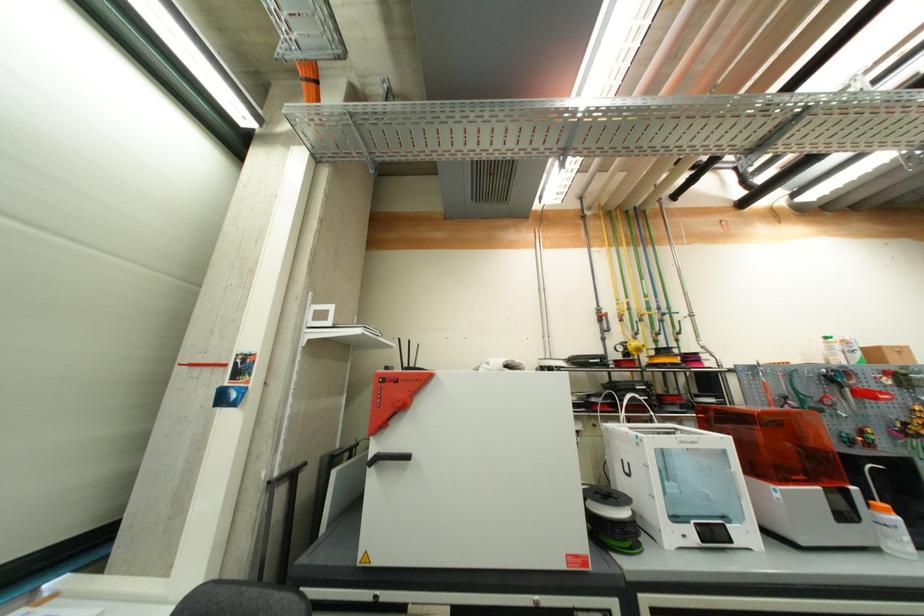
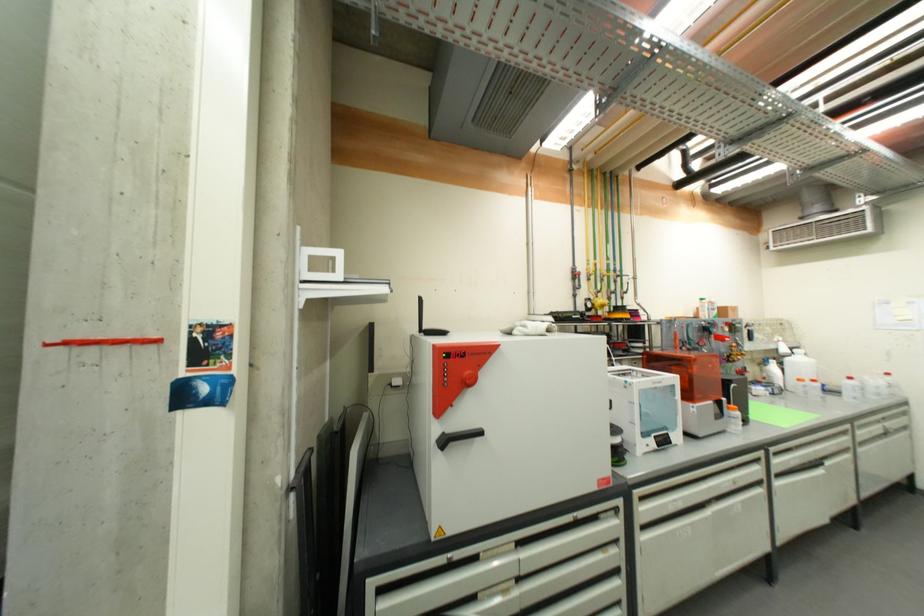
Which direction would the cameraman need to move to produce the second image?

The movement direction of the cameraman is left, forward.